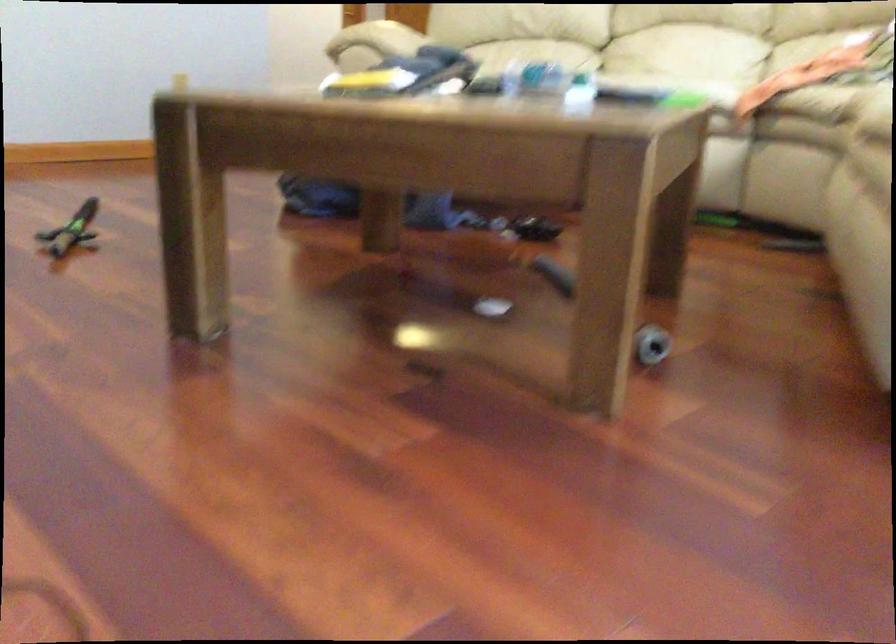
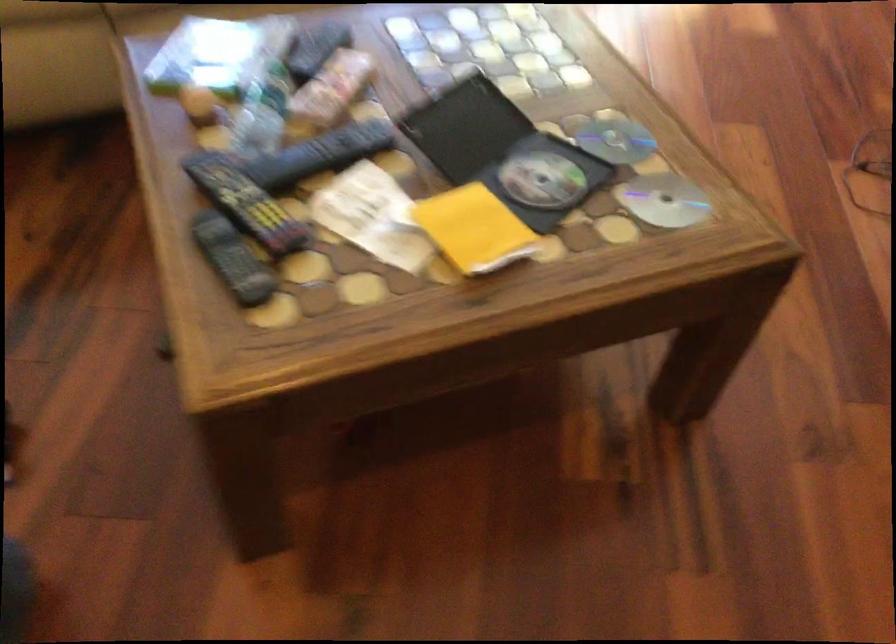
Find the pixel in the second image that matches (x=357, y=82) in the first image.

(474, 229)